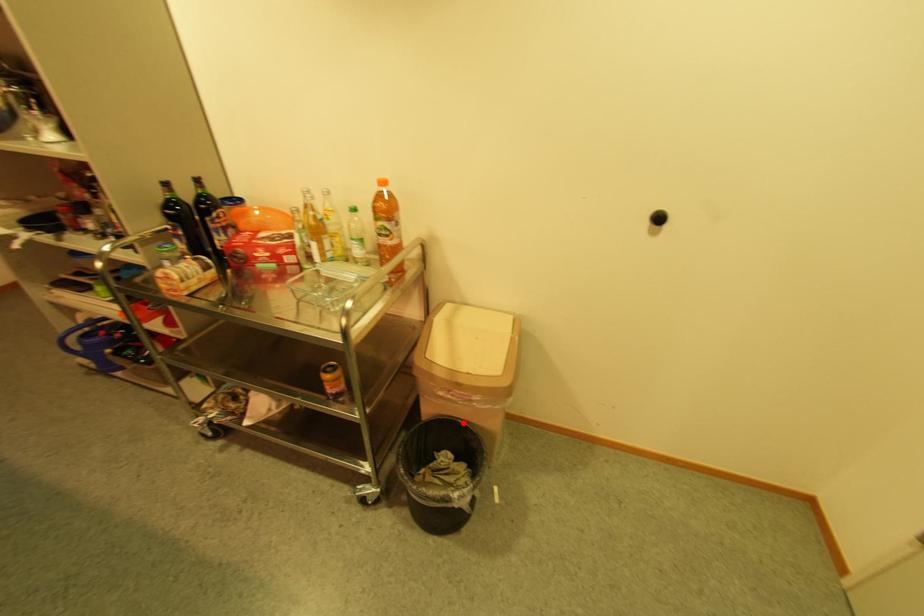
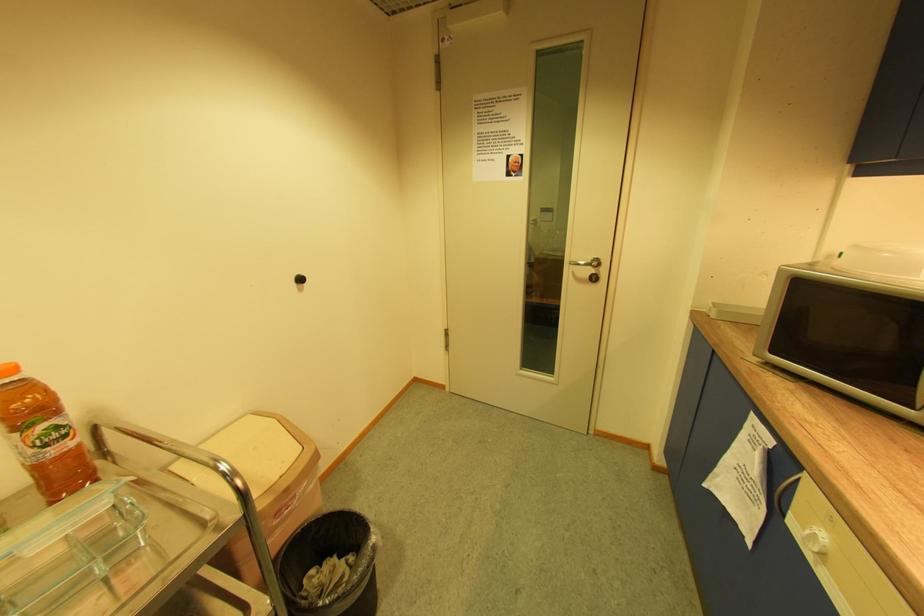
Question: I am providing you with two images of the same scene from different viewpoints. A red point is shown in image1. For the corresponding object point in image2, is it positioned nearer or farther from the camera?

Choices:
 (A) Nearer
 (B) Farther

Answer: (A)